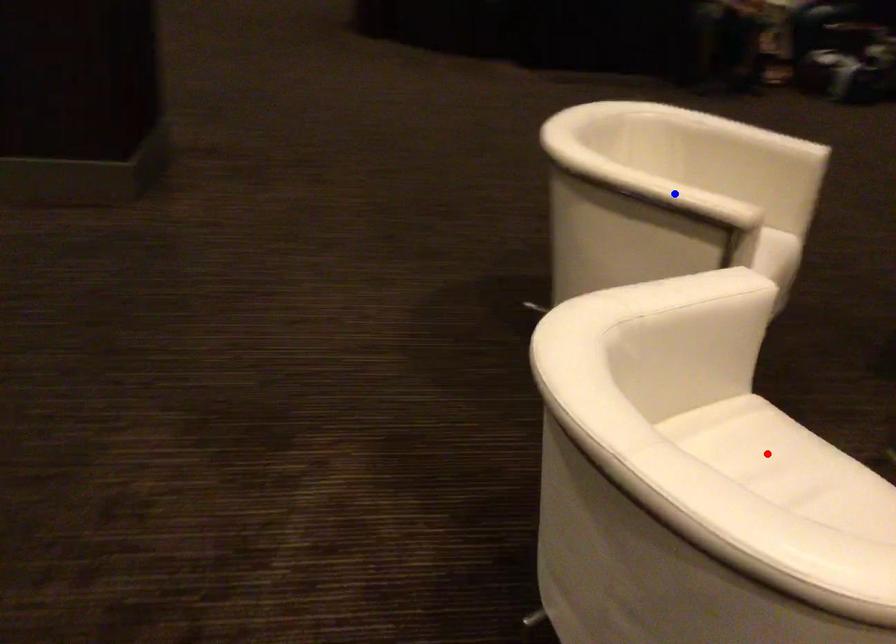
Question: Two points are marked on the image. Which point is closer to the camera?

Choices:
 (A) Blue point is closer.
 (B) Red point is closer.

Answer: (B)